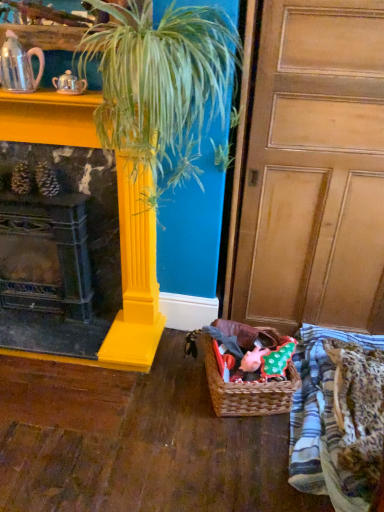
This screenshot has width=384, height=512. What do you see at coordinates (130, 283) in the screenshot?
I see `matte yellow fireplace at left` at bounding box center [130, 283].

The height and width of the screenshot is (512, 384). What do you see at coordinates (19, 65) in the screenshot?
I see `shiny silver teapot at upper left, the second tea pot viewed from the right` at bounding box center [19, 65].

What do you see at coordinates (159, 85) in the screenshot? The height and width of the screenshot is (512, 384). I see `yellow glossy column at center` at bounding box center [159, 85].

Locate an element on the screen. fluffy leopard print blanket at lower right is located at coordinates (338, 417).

The width and height of the screenshot is (384, 512). What are the coordinates of `matte yellow fireplace at left` in the screenshot? It's located at (130, 283).

Locate an element on the screen. This screenshot has width=384, height=512. door below the pink glossy teapot at upper left, the first tea pot when ordered from right to left (from a real-world perspective) is located at coordinates (315, 170).

Is wooden at right touching pink glossy teapot at upper left, the first tea pot when ordered from right to left?

No, wooden at right is not in contact with pink glossy teapot at upper left, the first tea pot when ordered from right to left.

From a real-world perspective, which object rests below the other?

wooden at right, from a real-world perspective.

From the image's perspective, between wooden at right and pink glossy teapot at upper left, the second tea pot in the left-to-right sequence, which one is located above?

pink glossy teapot at upper left, the second tea pot in the left-to-right sequence, is shown above in the image.

Is fluffy leopard print blanket at lower right beside pink glossy teapot at upper left, the second tea pot in the left-to-right sequence?

fluffy leopard print blanket at lower right and pink glossy teapot at upper left, the second tea pot in the left-to-right sequence, are not in contact.

Which object is closer to the camera taking this photo, fluffy leopard print blanket at lower right or pink glossy teapot at upper left, the second tea pot in the left-to-right sequence?

fluffy leopard print blanket at lower right.

Is point (296, 442) positioned in front of point (66, 71)?

Yes.

From the image's perspective, is wooden at right under shiny silver teapot at upper left, which ranks as the first tea pot in left-to-right order?

Indeed, from the image's perspective, wooden at right is shown beneath shiny silver teapot at upper left, which ranks as the first tea pot in left-to-right order.

I want to click on door located underneath the shiny silver teapot at upper left, which ranks as the first tea pot in left-to-right order (from a real-world perspective), so click(x=315, y=170).

Is shiny silver teapot at upper left, which ranks as the first tea pot in left-to-right order, surrounded by wooden at right?

No.

Locate an element on the screen. clothing that is in front of the brown woven basket at lower right is located at coordinates (338, 417).

Is brown woven basket at lower right facing towards fluffy leopard print blanket at lower right?

No, brown woven basket at lower right is not oriented towards fluffy leopard print blanket at lower right.

From the image's perspective, does brown woven basket at lower right appear lower than fluffy leopard print blanket at lower right?

Incorrect, from the image's perspective, brown woven basket at lower right is higher than fluffy leopard print blanket at lower right.

Between brown woven basket at lower right and fluffy leopard print blanket at lower right, which one has less height?

fluffy leopard print blanket at lower right is shorter.

Measure the distance between matte yellow fireplace at left and shiny silver teapot at upper left, which ranks as the first tea pot in left-to-right order.

matte yellow fireplace at left and shiny silver teapot at upper left, which ranks as the first tea pot in left-to-right order, are 18.63 inches apart.

From a real-world perspective, is matte yellow fireplace at left positioned over shiny silver teapot at upper left, the second tea pot viewed from the right, based on gravity?

Incorrect, from a real-world perspective, matte yellow fireplace at left is lower than shiny silver teapot at upper left, the second tea pot viewed from the right.

What's the angular difference between matte yellow fireplace at left and shiny silver teapot at upper left, which ranks as the first tea pot in left-to-right order,'s facing directions?

There is a 0.244-degree angle between the facing directions of matte yellow fireplace at left and shiny silver teapot at upper left, which ranks as the first tea pot in left-to-right order.

Is matte yellow fireplace at left spatially inside shiny silver teapot at upper left, which ranks as the first tea pot in left-to-right order, or outside of it?

matte yellow fireplace at left exists outside the volume of shiny silver teapot at upper left, which ranks as the first tea pot in left-to-right order.

From a real-world perspective, which is physically below, yellow glossy column at center or pink glossy teapot at upper left, the second tea pot in the left-to-right sequence?

yellow glossy column at center.

Is yellow glossy column at center to the left or to the right of pink glossy teapot at upper left, the first tea pot when ordered from right to left, in the image?

yellow glossy column at center is positioned on pink glossy teapot at upper left, the first tea pot when ordered from right to left,'s right side.

Can you confirm if yellow glossy column at center is shorter than pink glossy teapot at upper left, the second tea pot in the left-to-right sequence?

In fact, yellow glossy column at center may be taller than pink glossy teapot at upper left, the second tea pot in the left-to-right sequence.

Is the surface of yellow glossy column at center in direct contact with pink glossy teapot at upper left, the first tea pot when ordered from right to left?

No, yellow glossy column at center is not making contact with pink glossy teapot at upper left, the first tea pot when ordered from right to left.

Consider the image. In terms of height, does wooden at right look taller or shorter compared to brown woven basket at lower right?

In the image, wooden at right appears to be taller than brown woven basket at lower right.

Can you confirm if wooden at right is positioned to the right of brown woven basket at lower right?

Yes.

Which is further, (270, 179) or (237, 396)?

The point (270, 179) is farther.

Where is `door below the pink glossy teapot at upper left, the second tea pot in the left-to-right sequence (from the image's perspective)`? This screenshot has width=384, height=512. door below the pink glossy teapot at upper left, the second tea pot in the left-to-right sequence (from the image's perspective) is located at coordinates (315, 170).

From a real-world perspective, which tea pot is the 1st one above the fluffy leopard print blanket at lower right? Please provide its 2D coordinates.

[(69, 84)]

From the picture: From the image, which object appears to be farther from shiny silver teapot at upper left, which ranks as the first tea pot in left-to-right order, brown woven basket at lower right or fluffy leopard print blanket at lower right?

Among the two, fluffy leopard print blanket at lower right is located further to shiny silver teapot at upper left, which ranks as the first tea pot in left-to-right order.

Estimate the real-world distances between objects in this image. Which object is further from brown woven basket at lower right, wooden at right or matte yellow fireplace at left?

wooden at right.

Considering their positions, is brown woven basket at lower right positioned closer to matte yellow fireplace at left than yellow glossy column at center?

yellow glossy column at center lies closer to matte yellow fireplace at left than the other object.

When comparing their distances from pink glossy teapot at upper left, the second tea pot in the left-to-right sequence, does shiny silver teapot at upper left, the second tea pot viewed from the right, or wooden at right seem closer?

shiny silver teapot at upper left, the second tea pot viewed from the right, lies closer to pink glossy teapot at upper left, the second tea pot in the left-to-right sequence, than the other object.

When comparing their distances from yellow glossy column at center, does shiny silver teapot at upper left, which ranks as the first tea pot in left-to-right order, or pink glossy teapot at upper left, the first tea pot when ordered from right to left, seem further?

Among the two, shiny silver teapot at upper left, which ranks as the first tea pot in left-to-right order, is located further to yellow glossy column at center.

Which object lies further to the anchor point brown woven basket at lower right, shiny silver teapot at upper left, the second tea pot viewed from the right, or fluffy leopard print blanket at lower right?

shiny silver teapot at upper left, the second tea pot viewed from the right, is positioned further to the anchor brown woven basket at lower right.

Considering their positions, is yellow glossy column at center positioned closer to wooden at right than pink glossy teapot at upper left, the first tea pot when ordered from right to left?

Among the two, yellow glossy column at center is located nearer to wooden at right.

Based on their spatial positions, is matte yellow fireplace at left or pink glossy teapot at upper left, the first tea pot when ordered from right to left, further from shiny silver teapot at upper left, which ranks as the first tea pot in left-to-right order?

matte yellow fireplace at left is further to shiny silver teapot at upper left, which ranks as the first tea pot in left-to-right order.

Locate an element on the screen. The width and height of the screenshot is (384, 512). fireplace between shiny silver teapot at upper left, which ranks as the first tea pot in left-to-right order, and brown woven basket at lower right in the up-down direction is located at coordinates (130, 283).

Where is `basket between yellow glossy column at center and fluffy leopard print blanket at lower right in the vertical direction`? The height and width of the screenshot is (512, 384). basket between yellow glossy column at center and fluffy leopard print blanket at lower right in the vertical direction is located at coordinates (245, 389).

The width and height of the screenshot is (384, 512). Find the location of `houseplant that lies between pink glossy teapot at upper left, the second tea pot in the left-to-right sequence, and matte yellow fireplace at left from top to bottom`. houseplant that lies between pink glossy teapot at upper left, the second tea pot in the left-to-right sequence, and matte yellow fireplace at left from top to bottom is located at coordinates (159, 85).

Where is `door between yellow glossy column at center and brown woven basket at lower right from top to bottom`? door between yellow glossy column at center and brown woven basket at lower right from top to bottom is located at coordinates (315, 170).